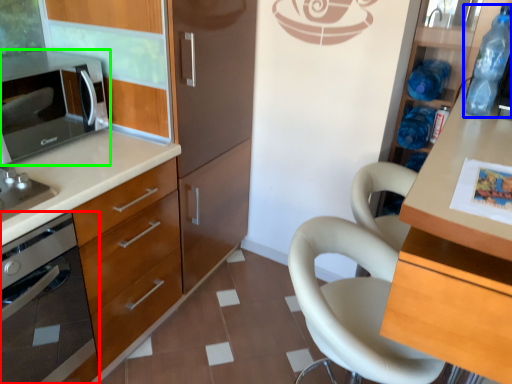
Question: Which object is positioned closest to home appliance (highlighted by a red box)? Select from bottle (highlighted by a blue box) and microwave oven (highlighted by a green box).

Choices:
 (A) bottle
 (B) microwave oven

Answer: (B)